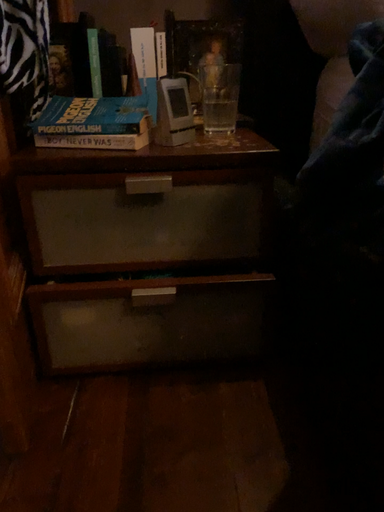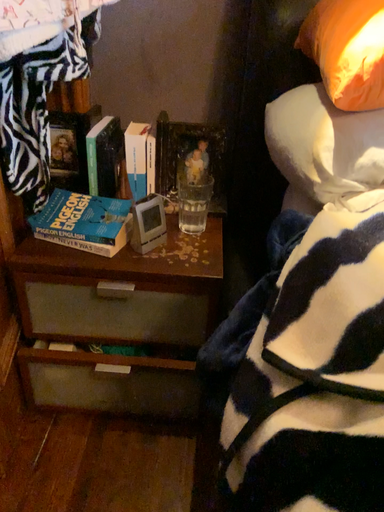
Question: Which way did the camera rotate in the video?

Choices:
 (A) rotated downward
 (B) rotated upward

Answer: (A)